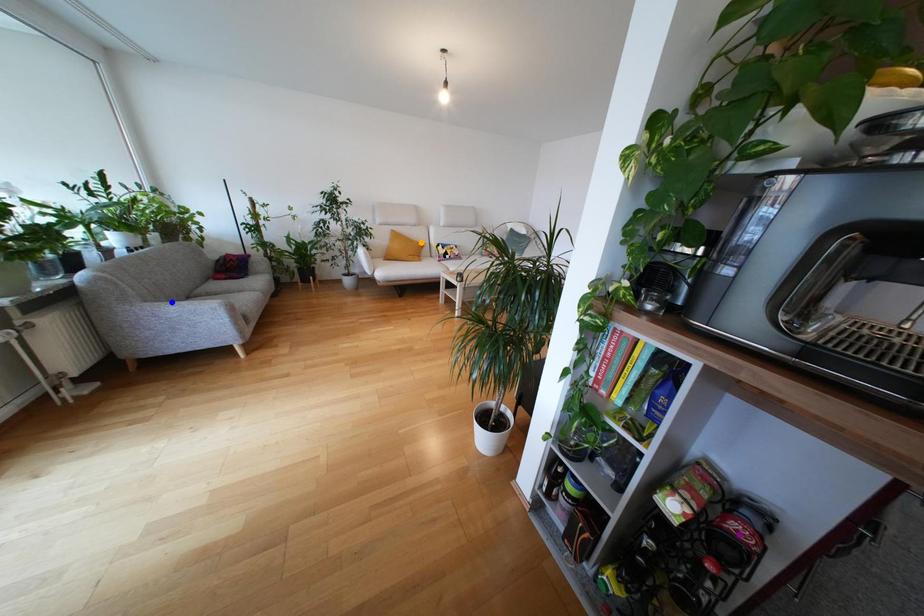
Order these from nearest to farthest:
- orange point
- purple point
- blue point

purple point → blue point → orange point